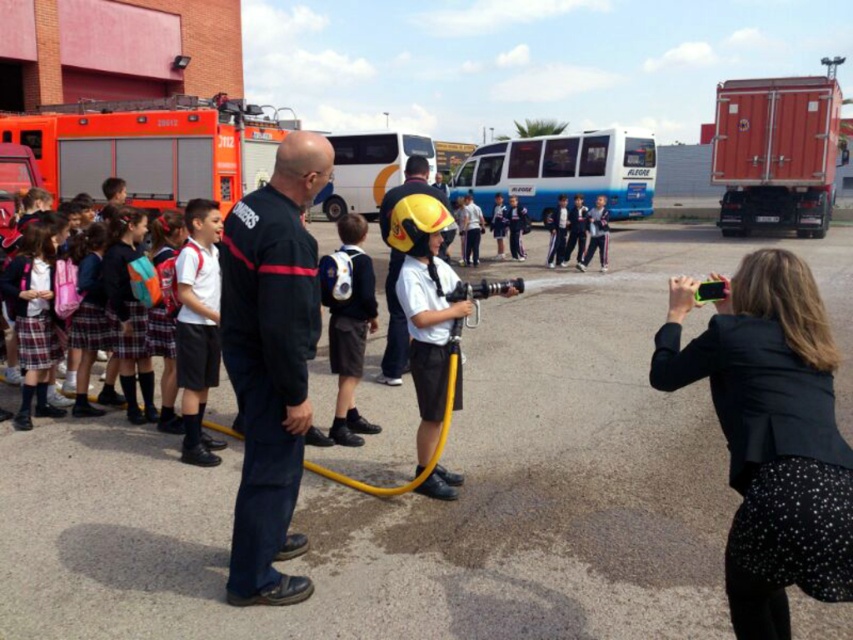
Does metallic red fire truck at upper right have a smaller size compared to yellow matte helmet at center?

No.

Which is behind, point (737, 192) or point (396, 376)?

The point (737, 192) is more distant.

Identify the location of metallic red fire truck at upper right. (776, 152).

Between black textured blazer at lower right and metallic red fire truck at upper right, which one has more height?

Standing taller between the two is metallic red fire truck at upper right.

Who is positioned more to the left, black textured blazer at lower right or metallic red fire truck at upper right?

black textured blazer at lower right

What are the coordinates of `black textured blazer at lower right` in the screenshot? It's located at (770, 465).

Who is positioned more to the left, black uniform at center or matte black backpack at center?

From the viewer's perspective, black uniform at center appears more on the left side.

Who is higher up, black uniform at center or matte black backpack at center?

matte black backpack at center is higher up.

Find the location of a particular element. The width and height of the screenshot is (853, 640). black uniform at center is located at coordinates (271, 362).

Where is `black uniform at center`? The width and height of the screenshot is (853, 640). black uniform at center is located at coordinates point(271,362).